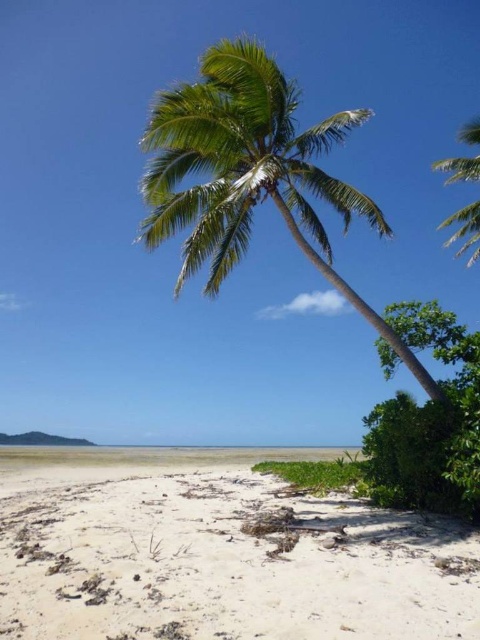
Is white sandy beach at lower center to the left of green leafy palm tree at upper right from the viewer's perspective?

Yes, white sandy beach at lower center is to the left of green leafy palm tree at upper right.

Is point (280, 486) closer to camera compared to point (478, 118)?

Yes, it is.

Where is `white sandy beach at lower center`? This screenshot has height=640, width=480. white sandy beach at lower center is located at coordinates (216, 552).

Can you confirm if green leafy palm tree at center is positioned to the right of green leafy palm tree at upper right?

No, green leafy palm tree at center is not to the right of green leafy palm tree at upper right.

Which is above, green leafy palm tree at center or green leafy palm tree at upper right?

Positioned higher is green leafy palm tree at upper right.

Which is in front, point (201, 88) or point (468, 241)?

Point (201, 88) is in front.

Find the location of a particular element. The image size is (480, 640). green leafy palm tree at center is located at coordinates (250, 173).

Can you confirm if white sandy beach at lower center is positioned to the right of green leafy palm tree at center?

In fact, white sandy beach at lower center is to the left of green leafy palm tree at center.

Is white sandy beach at lower center above green leafy palm tree at center?

No, white sandy beach at lower center is not above green leafy palm tree at center.

Who is more forward, (x=348, y=625) or (x=335, y=205)?

Point (x=348, y=625)

Where is `white sandy beach at lower center`? The image size is (480, 640). white sandy beach at lower center is located at coordinates (216, 552).